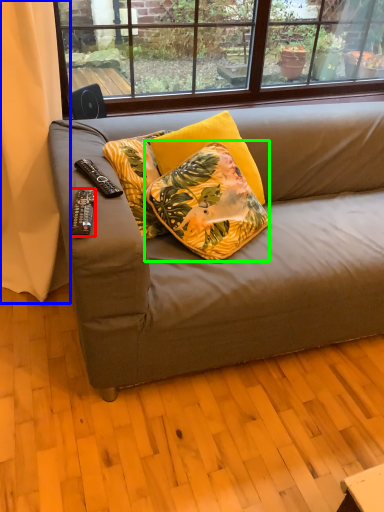
Question: Estimate the real-world distances between objects in this image. Which object is farther from remote control (highlighted by a red box), curtain (highlighted by a blue box) or pillow (highlighted by a green box)?

Choices:
 (A) curtain
 (B) pillow

Answer: (A)